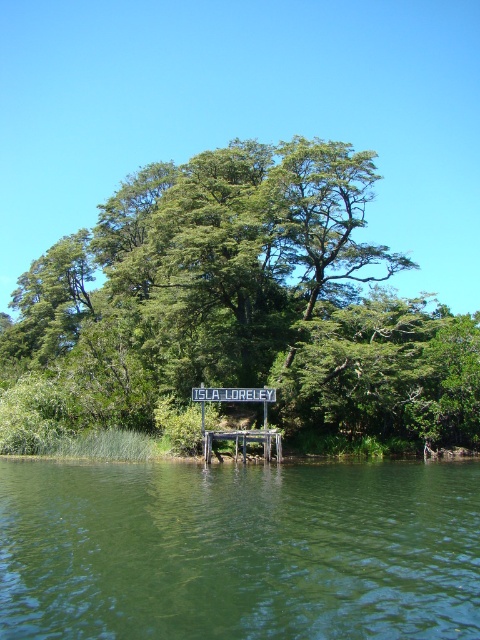
Question: Is green leafy tree at center positioned before green smooth water at center?

Choices:
 (A) yes
 (B) no

Answer: (B)

Question: Does wooden dock at center have a greater width compared to white plastic sign at center?

Choices:
 (A) yes
 (B) no

Answer: (B)

Question: Considering the relative positions of green leafy tree at center and green smooth water at center in the image provided, where is green leafy tree at center located with respect to green smooth water at center?

Choices:
 (A) below
 (B) above

Answer: (B)

Question: Which is farther from the white plastic sign at center?

Choices:
 (A) green smooth water at center
 (B) green leafy tree at center
 (C) wooden dock at center

Answer: (B)

Question: Which object is farther from the camera taking this photo?

Choices:
 (A) green smooth water at center
 (B) wooden dock at center

Answer: (B)

Question: Which of the following is the closest to the observer?

Choices:
 (A) (345, 241)
 (B) (192, 397)

Answer: (B)